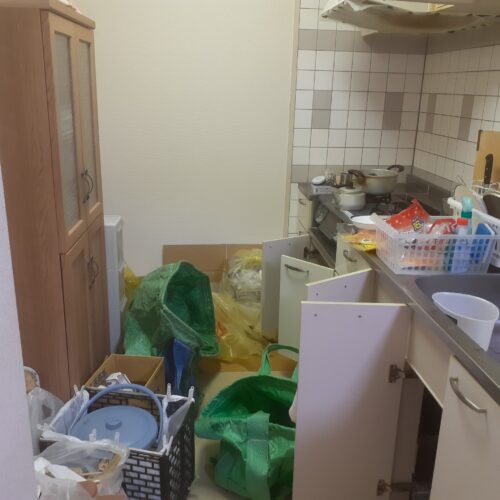
Locate an element on the screen. This screenshot has height=500, width=500. hinge is located at coordinates (390, 368), (383, 484).